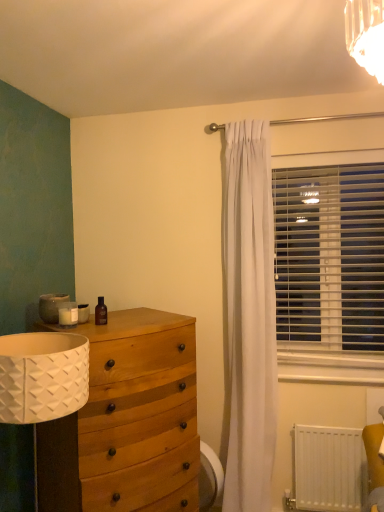
This screenshot has height=512, width=384. What are the coordinates of `free space in front of brown glass bottle at upper left` in the screenshot? It's located at (93, 332).